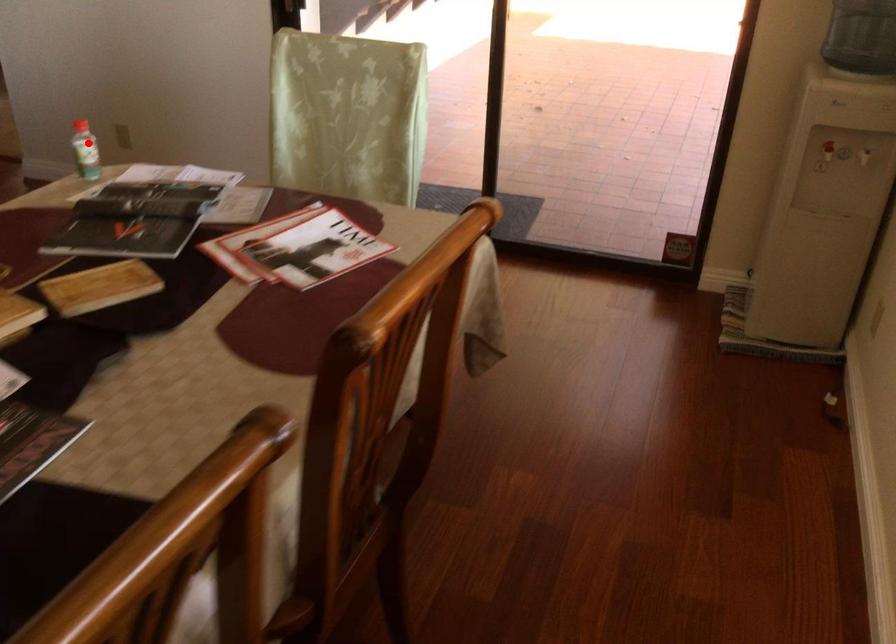
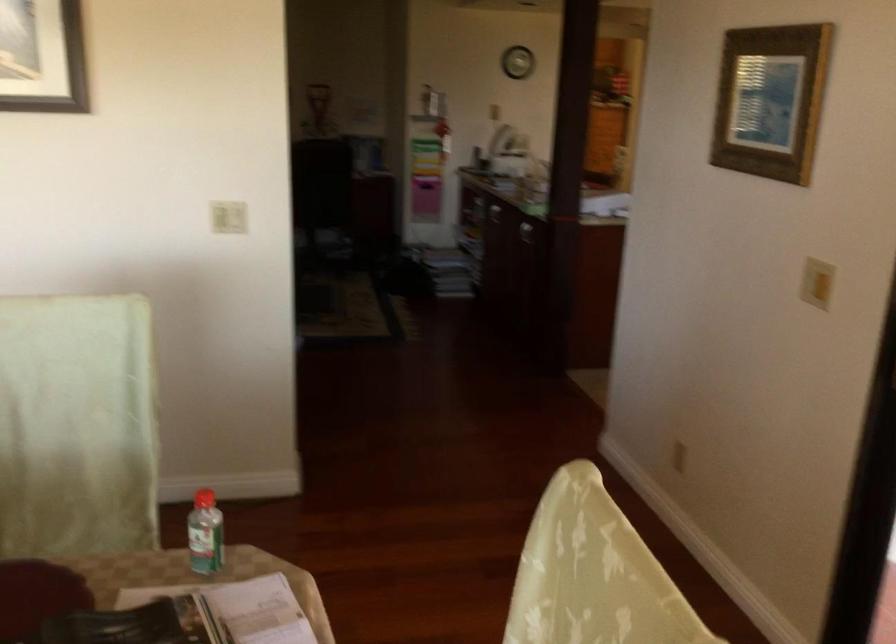
The point at the highlighted location is marked in the first image. Where is the corresponding point in the second image?

(204, 534)